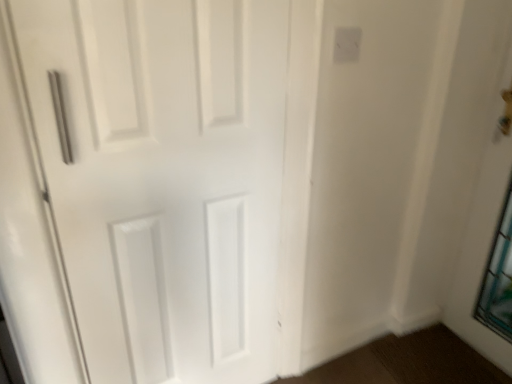
Image resolution: width=512 pixels, height=384 pixels. Describe the element at coordinates (347, 44) in the screenshot. I see `white plastic electric outlet at upper right` at that location.

Where is `white plastic electric outlet at upper right`? white plastic electric outlet at upper right is located at coordinates (347, 44).

What do you see at coordinates (163, 177) in the screenshot?
I see `white matte door at left` at bounding box center [163, 177].

Locate an element on the screen. The width and height of the screenshot is (512, 384). white matte door at left is located at coordinates (163, 177).

You are a GUI agent. You are given a task and a screenshot of the screen. Output one action in this format:
    pyautogui.click(x=<x>, y=<y>)
    Task: Click on the white plastic electric outlet at upper right
    
    Given the screenshot: What is the action you would take?
    pyautogui.click(x=347, y=44)

Considering the positions of objects white matte door at left and white plastic electric outlet at upper right in the image provided, who is more to the left, white matte door at left or white plastic electric outlet at upper right?

From the viewer's perspective, white matte door at left appears more on the left side.

Looking at this image, considering their positions, is white matte door at left located in front of or behind white plastic electric outlet at upper right?

Clearly, white matte door at left is in front of white plastic electric outlet at upper right.

Which is behind, point (57, 146) or point (358, 28)?

The point (358, 28) is behind.

From the image's perspective, is white matte door at left located beneath white plastic electric outlet at upper right?

Yes, from the image's perspective, white matte door at left is beneath white plastic electric outlet at upper right.

From a real-world perspective, who is located lower, white matte door at left or white plastic electric outlet at upper right?

white matte door at left.

Between white matte door at left and white plastic electric outlet at upper right, which one has larger width?

Wider between the two is white matte door at left.

Between white matte door at left and white plastic electric outlet at upper right, which one has more height?

With more height is white matte door at left.

Considering the sizes of objects white matte door at left and white plastic electric outlet at upper right in the image provided, who is smaller, white matte door at left or white plastic electric outlet at upper right?

With smaller size is white plastic electric outlet at upper right.

Do you think white matte door at left is within white plastic electric outlet at upper right, or outside of it?

white matte door at left is not enclosed by white plastic electric outlet at upper right.

Is there a large distance between white matte door at left and white plastic electric outlet at upper right?

No.

Is white matte door at left oriented towards white plastic electric outlet at upper right?

No, white matte door at left is not facing towards white plastic electric outlet at upper right.

Can you tell me how much white matte door at left and white plastic electric outlet at upper right differ in facing direction?

The facing directions of white matte door at left and white plastic electric outlet at upper right are 1.97 degrees apart.

The height and width of the screenshot is (384, 512). What are the coordinates of `door below the white plastic electric outlet at upper right (from the image's perspective)` in the screenshot? It's located at (163, 177).

Which is more to the right, white plastic electric outlet at upper right or white matte door at left?

white plastic electric outlet at upper right.

Is white plastic electric outlet at upper right positioned behind white matte door at left?

Yes, white plastic electric outlet at upper right is behind white matte door at left.

Is point (341, 49) positioned after point (269, 249)?

No, it is not.

From the image's perspective, between white plastic electric outlet at upper right and white matte door at left, which one is located above?

white plastic electric outlet at upper right is shown above in the image.

Consider the image. From a real-world perspective, is white plastic electric outlet at upper right beneath white matte door at left?

No, from a real-world perspective, white plastic electric outlet at upper right is not under white matte door at left.

Based on the photo, which object is wider, white plastic electric outlet at upper right or white matte door at left?

white matte door at left is wider.

Is white plastic electric outlet at upper right taller than white matte door at left?

No.

Does white plastic electric outlet at upper right have a larger size compared to white matte door at left?

Incorrect, white plastic electric outlet at upper right is not larger than white matte door at left.

Would you say white matte door at left is part of white plastic electric outlet at upper right's contents?

No, white matte door at left is located outside of white plastic electric outlet at upper right.

Are white plastic electric outlet at upper right and white matte door at left beside each other?

No, white plastic electric outlet at upper right is not next to white matte door at left.

Is white plastic electric outlet at upper right positioned with its back to white matte door at left?

No, white plastic electric outlet at upper right is not facing the opposite direction of white matte door at left.

At what (x,y) coordinates should I click in order to perform the action: click on door beneath the white plastic electric outlet at upper right (from a real-world perspective). Please return your answer as a coordinate pair (x, y). The width and height of the screenshot is (512, 384). Looking at the image, I should click on (163, 177).

Locate an element on the screen. Image resolution: width=512 pixels, height=384 pixels. door lying in front of the white plastic electric outlet at upper right is located at coordinates (163, 177).

There is a white matte door at left. Where is `electric outlet above it (from a real-world perspective)`? The image size is (512, 384). electric outlet above it (from a real-world perspective) is located at coordinates (347, 44).